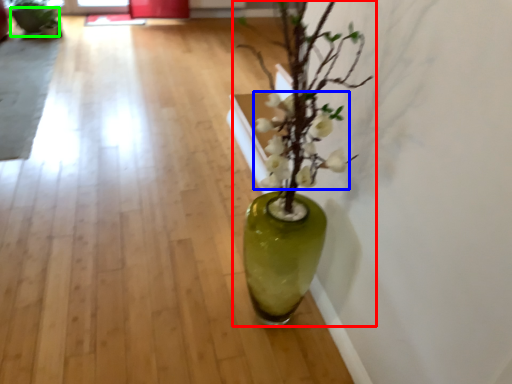
Question: Which object is positioned farthest from houseplant (highlighted by a red box)? Select from flower (highlighted by a blue box) and flowerpot (highlighted by a green box).

Choices:
 (A) flower
 (B) flowerpot

Answer: (B)